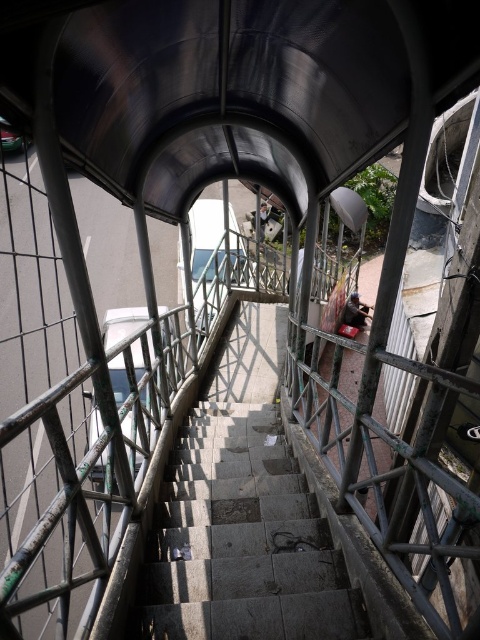
You are standing on the gray concrete stairs at center and want to place the metallic silver skateboard at center on the steps. Can the skateboard fit vertically along the stairs?

The gray concrete stairs at center is shorter than the metallic silver skateboard at center, so the skateboard cannot fit vertically along the stairs because it is taller than the stairs.

You are standing on the gray concrete stairs at center and want to place your metallic silver skateboard at center on the bridge. Since the stairs are in the way, can you move the skateboard to a position where it won

The gray concrete stairs at center are closer to the viewer than the metallic silver skateboard at center, so the skateboard is behind the stairs. To move it forward, you would need to place it in front of the stairs where it can be seen.